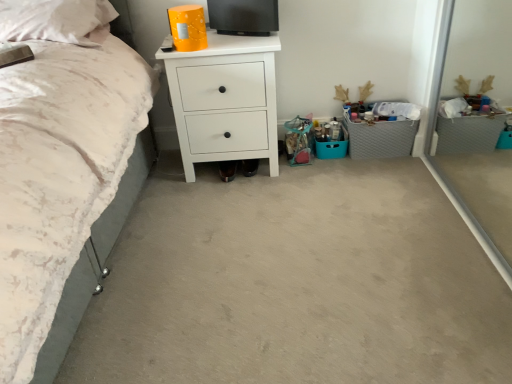
Question: From a real-world perspective, is white soft pillow at upper left above or below gray fabric storage at right?

Choices:
 (A) below
 (B) above

Answer: (B)

Question: Would you say white soft pillow at upper left is inside or outside gray fabric storage at right?

Choices:
 (A) inside
 (B) outside

Answer: (B)

Question: Estimate the real-world distances between objects in this image. Which object is closer to the white matte chest of drawers at center?

Choices:
 (A) gray fabric storage at right
 (B) white soft pillow at upper left

Answer: (B)

Question: Which of these objects is positioned farthest from the gray fabric storage at right?

Choices:
 (A) white soft pillow at upper left
 (B) white matte chest of drawers at center

Answer: (A)